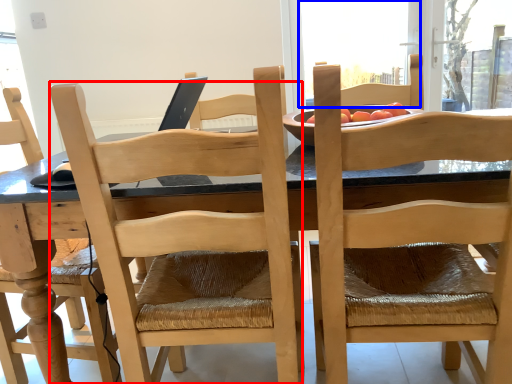
Question: Which object is closer to the camera taking this photo, chair (highlighted by a red box) or window screen (highlighted by a blue box)?

Choices:
 (A) chair
 (B) window screen

Answer: (A)